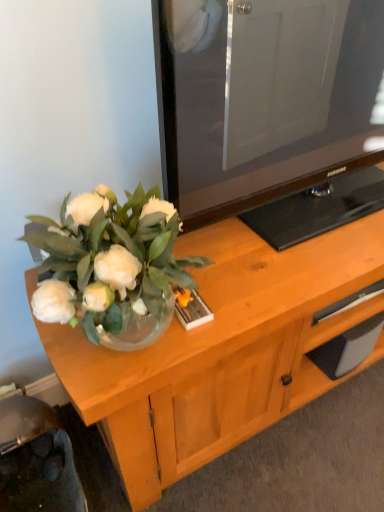
Question: Would you say wooden cabinet at center is part of black rubber drawer at lower right's contents?

Choices:
 (A) yes
 (B) no

Answer: (B)

Question: Considering the relative sizes of black rubber drawer at lower right and wooden cabinet at center in the image provided, is black rubber drawer at lower right wider than wooden cabinet at center?

Choices:
 (A) yes
 (B) no

Answer: (B)

Question: From a real-world perspective, is black rubber drawer at lower right located higher than wooden cabinet at center?

Choices:
 (A) yes
 (B) no

Answer: (A)

Question: Does black rubber drawer at lower right have a lesser height compared to wooden cabinet at center?

Choices:
 (A) yes
 (B) no

Answer: (B)

Question: Does black rubber drawer at lower right have a smaller size compared to wooden cabinet at center?

Choices:
 (A) yes
 (B) no

Answer: (A)

Question: Is metallic silver swivel chair at lower left situated inside black rubber drawer at lower right or outside?

Choices:
 (A) inside
 (B) outside

Answer: (B)

Question: From their relative heights in the image, would you say metallic silver swivel chair at lower left is taller or shorter than black rubber drawer at lower right?

Choices:
 (A) tall
 (B) short

Answer: (A)

Question: Does point (18, 496) appear closer or farther from the camera than point (317, 349)?

Choices:
 (A) farther
 (B) closer

Answer: (B)

Question: Considering the positions of metallic silver swivel chair at lower left and black rubber drawer at lower right in the image, is metallic silver swivel chair at lower left wider or thinner than black rubber drawer at lower right?

Choices:
 (A) thin
 (B) wide

Answer: (B)

Question: Is metallic silver swivel chair at lower left inside the boundaries of wooden cabinet at center, or outside?

Choices:
 (A) inside
 (B) outside

Answer: (B)

Question: In terms of size, does metallic silver swivel chair at lower left appear bigger or smaller than wooden cabinet at center?

Choices:
 (A) small
 (B) big

Answer: (B)

Question: Relative to wooden cabinet at center, is metallic silver swivel chair at lower left in front or behind?

Choices:
 (A) behind
 (B) front

Answer: (B)

Question: From the image's perspective, is metallic silver swivel chair at lower left positioned above or below wooden cabinet at center?

Choices:
 (A) above
 (B) below

Answer: (B)

Question: Is point click(311, 396) closer or farther from the camera than point click(51, 483)?

Choices:
 (A) farther
 (B) closer

Answer: (A)

Question: Do you think black rubber drawer at lower right is within metallic silver swivel chair at lower left, or outside of it?

Choices:
 (A) inside
 (B) outside

Answer: (B)